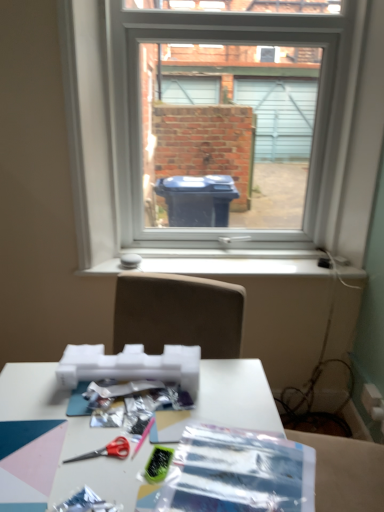
Describe the element at coordinates (107, 451) in the screenshot. This screenshot has width=384, height=512. I see `red plastic scissors at lower center` at that location.

The width and height of the screenshot is (384, 512). Describe the element at coordinates (346, 472) in the screenshot. I see `white matte table at lower center` at that location.

In order to click on white plastic window sill at center in this screenshot , I will do `click(218, 263)`.

Locate an element on the screen. The image size is (384, 512). white plastic window at center is located at coordinates (230, 101).

Describe the element at coordinates (230, 101) in the screenshot. Image resolution: width=384 pixels, height=512 pixels. I see `white plastic window at center` at that location.

You are a GUI agent. You are given a task and a screenshot of the screen. Output one action in this format:
    pyautogui.click(x=<x>, y=<y>)
    Task: Click on the red plastic scissors at lower center
    
    Given the screenshot: What is the action you would take?
    pyautogui.click(x=107, y=451)

Image resolution: width=384 pixels, height=512 pixels. I want to click on wrapping paper that is above the white matte table at lower center (from the image's perspective), so click(240, 473).

Between white matte table at lower center and translucent plastic wrapping paper at center, which one has less height?

With less height is translucent plastic wrapping paper at center.

Can you confirm if white matte table at lower center is thinner than translucent plastic wrapping paper at center?

No.

Which of these two, white matte table at lower center or translucent plastic wrapping paper at center, is bigger?

white matte table at lower center is bigger.

From the image's perspective, between red plastic scissors at lower center and white matte table at lower center, which one is located above?

From the image's view, red plastic scissors at lower center is above.

Is red plastic scissors at lower center far away from white matte table at lower center?

That's not correct — red plastic scissors at lower center is a little close to white matte table at lower center.

Is the position of red plastic scissors at lower center more distant than that of white matte table at lower center?

Yes.

Looking at this image, from the image's perspective, does white plastic window at center appear higher than white matte table at lower center?

Indeed, from the image's perspective, white plastic window at center is shown above white matte table at lower center.

Are white plastic window at center and white matte table at lower center far apart?

Yes, white plastic window at center and white matte table at lower center are quite far apart.

Considering the relative sizes of white plastic window at center and white matte table at lower center in the image provided, is white plastic window at center bigger than white matte table at lower center?

No, white plastic window at center is not bigger than white matte table at lower center.

Is white plastic window at center looking in the opposite direction of white matte table at lower center?

No, white matte table at lower center is not at the back of white plastic window at center.

Could you measure the distance between translucent plastic wrapping paper at center and white plastic window sill at center?

translucent plastic wrapping paper at center is 3.40 feet from white plastic window sill at center.

From the image's perspective, who appears lower, translucent plastic wrapping paper at center or white plastic window sill at center?

From the image's view, translucent plastic wrapping paper at center is below.

Which is in front, translucent plastic wrapping paper at center or white plastic window sill at center?

translucent plastic wrapping paper at center is more forward.

Is point (229, 445) positioned before point (225, 258)?

That is True.

Is white plastic window sill at center at the back of white plastic window at center?

No, white plastic window at center is not facing the opposite direction of white plastic window sill at center.

How many degrees apart are the facing directions of white plastic window at center and white plastic window sill at center?

The angle between the facing direction of white plastic window at center and the facing direction of white plastic window sill at center is 0.149 degrees.

In terms of width, does white plastic window at center look wider or thinner when compared to white plastic window sill at center?

Considering their sizes, white plastic window at center looks broader than white plastic window sill at center.

Is white plastic window at center taller than white plastic window sill at center?

Correct, white plastic window at center is much taller as white plastic window sill at center.

Is white plastic window sill at center not close to translucent plastic wrapping paper at center?

That's right, there is a large distance between white plastic window sill at center and translucent plastic wrapping paper at center.

From the image's perspective, who appears lower, white plastic window sill at center or translucent plastic wrapping paper at center?

translucent plastic wrapping paper at center, from the image's perspective.

Which point is more distant from viewer, (274,262) or (223,492)?

The point (274,262) is farther from the camera.

Is red plastic scissors at lower center at the right side of white plastic window at center?

No, red plastic scissors at lower center is not to the right of white plastic window at center.

At what (x,y) coordinates should I click in order to perform the action: click on scissors in front of the white plastic window at center. Please return your answer as a coordinate pair (x, y). Looking at the image, I should click on (107, 451).

Considering the sizes of objects red plastic scissors at lower center and white plastic window at center in the image provided, who is thinner, red plastic scissors at lower center or white plastic window at center?

red plastic scissors at lower center is thinner.

The width and height of the screenshot is (384, 512). Find the location of `wrapping paper on the right of white matte table at lower center`. wrapping paper on the right of white matte table at lower center is located at coordinates (240, 473).

This screenshot has width=384, height=512. What are the coordinates of `table in front of the red plastic scissors at lower center` in the screenshot? It's located at (346, 472).

Which object lies further to the anchor point white plastic window sill at center, red plastic scissors at lower center or white plastic window at center?

The object further to white plastic window sill at center is red plastic scissors at lower center.

When comparing their distances from white plastic window sill at center, does white matte table at lower center or white plastic window at center seem closer?

white plastic window at center.

Looking at the image, which one is located further to white plastic window sill at center, white plastic window at center or red plastic scissors at lower center?

red plastic scissors at lower center.

Looking at the image, which one is located further to red plastic scissors at lower center, white plastic window at center or translucent plastic wrapping paper at center?

A: white plastic window at center is positioned further to the anchor red plastic scissors at lower center.

Looking at this image, based on their spatial positions, is translucent plastic wrapping paper at center or red plastic scissors at lower center closer to white plastic window at center?

translucent plastic wrapping paper at center lies closer to white plastic window at center than the other object.

Based on their spatial positions, is white matte table at lower center or white plastic window at center closer to translucent plastic wrapping paper at center?

Based on the image, white matte table at lower center appears to be nearer to translucent plastic wrapping paper at center.

Looking at the image, which one is located closer to red plastic scissors at lower center, translucent plastic wrapping paper at center or white plastic window sill at center?

translucent plastic wrapping paper at center lies closer to red plastic scissors at lower center than the other object.

Considering their positions, is red plastic scissors at lower center positioned further to white plastic window at center than white plastic window sill at center?

red plastic scissors at lower center lies further to white plastic window at center than the other object.

Find the location of a particular element. Image resolution: width=384 pixels, height=512 pixels. window located between translucent plastic wrapping paper at center and white plastic window sill at center in the depth direction is located at coordinates (230, 101).

This screenshot has width=384, height=512. What are the coordinates of `window sill between white plastic window at center and red plastic scissors at lower center from top to bottom` in the screenshot? It's located at (218, 263).

At what (x,y) coordinates should I click in order to perform the action: click on window sill between white plastic window at center and white matte table at lower center in the up-down direction. Please return your answer as a coordinate pair (x, y). Looking at the image, I should click on (218, 263).

At what (x,y) coordinates should I click in order to perform the action: click on table situated between red plastic scissors at lower center and translucent plastic wrapping paper at center from left to right. Please return your answer as a coordinate pair (x, y). Looking at the image, I should click on (346, 472).